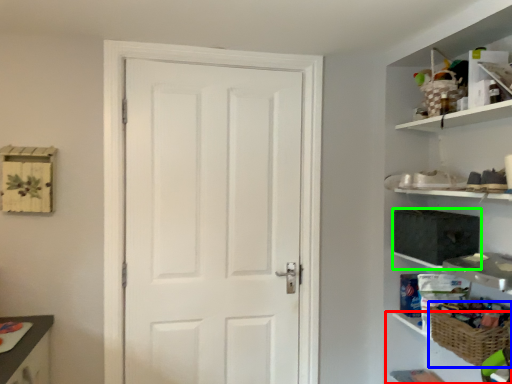
Question: Estimate the real-world distances between objects in this image. Which object is closer to cabinet (highlighted by a red box), basket (highlighted by a blue box) or medicine cabinet (highlighted by a green box)?

Choices:
 (A) basket
 (B) medicine cabinet

Answer: (A)